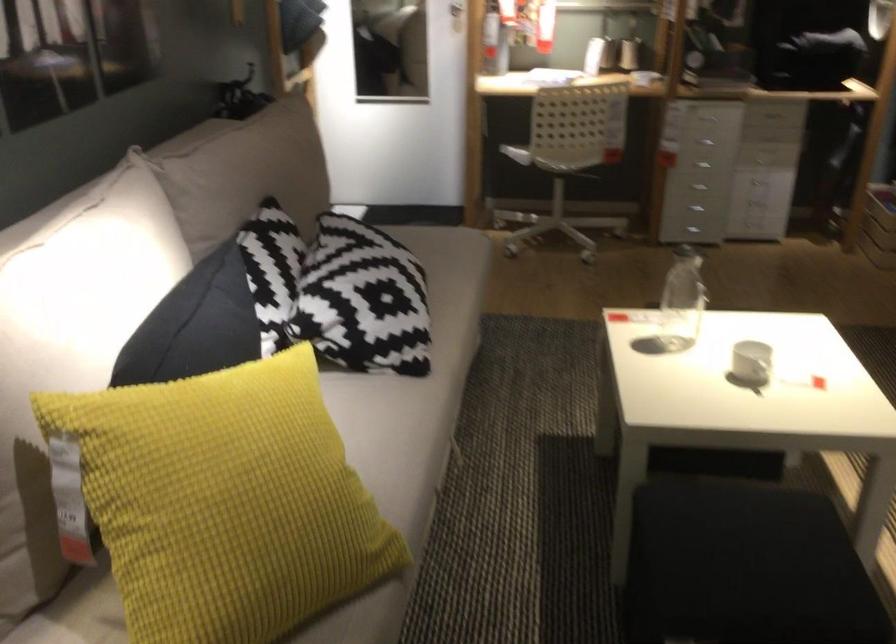
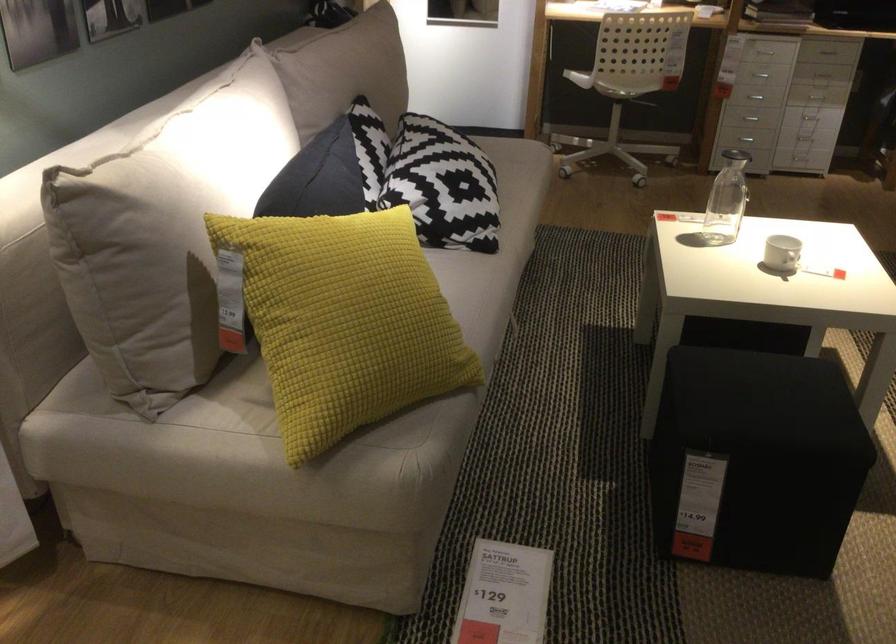
The point at (776, 120) is marked in the first image. Where is the corresponding point in the second image?

(826, 51)